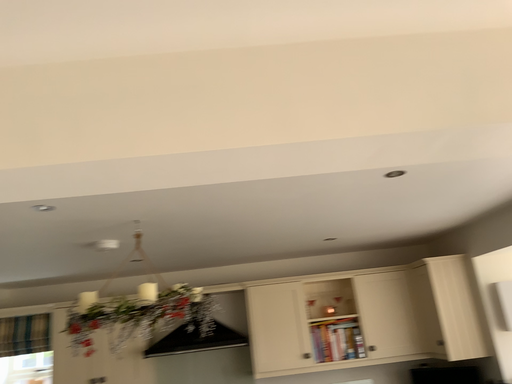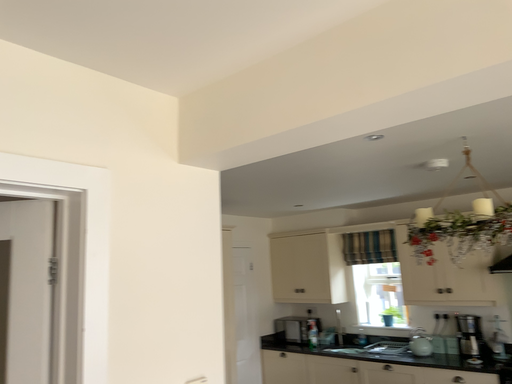
Question: How did the camera likely rotate when shooting the video?

Choices:
 (A) rotated left
 (B) rotated right

Answer: (A)